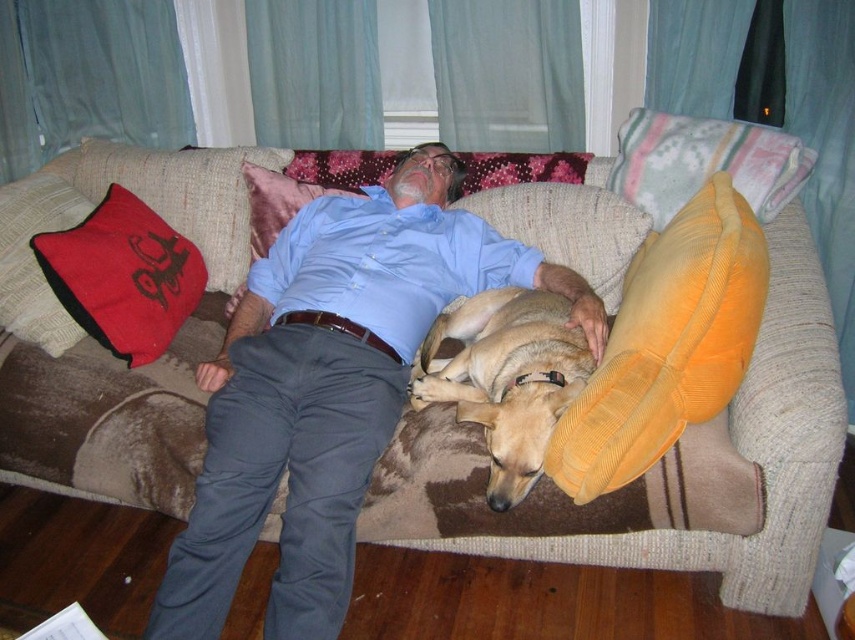
Question: Which of the following is the farthest from the observer?

Choices:
 (A) blue cotton shirt at center
 (B) velvet red pillow at left
 (C) red corduroy pillow at upper center

Answer: (C)

Question: Which of these objects is positioned closest to the orange corduroy pillow at right?

Choices:
 (A) brown corduroy dog at center
 (B) red corduroy pillow at upper center
 (C) blue cotton shirt at center

Answer: (A)

Question: Observing the image, what is the correct spatial positioning of blue cotton shirt at center in reference to red corduroy pillow at upper center?

Choices:
 (A) left
 (B) right

Answer: (B)

Question: Which object is farther from the camera taking this photo?

Choices:
 (A) brown corduroy dog at center
 (B) red corduroy pillow at upper center
 (C) orange corduroy pillow at right
 (D) blue cotton shirt at center

Answer: (B)

Question: Does brown corduroy dog at center have a greater width compared to velvet red pillow at left?

Choices:
 (A) yes
 (B) no

Answer: (A)

Question: Can you confirm if blue cotton shirt at center is positioned to the right of brown corduroy dog at center?

Choices:
 (A) no
 (B) yes

Answer: (A)